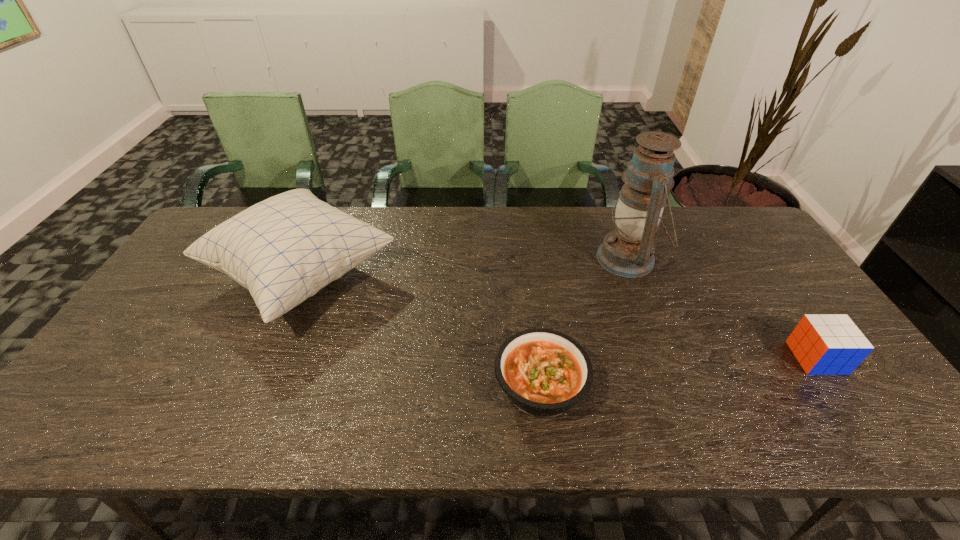
The image size is (960, 540). I want to click on vacant area situated 0.380m on the left of the third tallest object, so click(643, 357).

Find the location of a particular element. vacant space located on the left of the third object from right to left is located at coordinates (379, 385).

Identify the location of oil lamp at the far edge. This screenshot has width=960, height=540. (628, 251).

The image size is (960, 540). I want to click on cushion present at the far edge, so click(284, 249).

This screenshot has height=540, width=960. In order to click on object that is at the near edge in this screenshot , I will do `click(544, 372)`.

You are a GUI agent. You are given a task and a screenshot of the screen. Output one action in this format:
    pyautogui.click(x=<x>, y=<y>)
    Task: Click on the object that is at the left edge
    The height and width of the screenshot is (540, 960).
    Given the screenshot: What is the action you would take?
    pos(284,249)

The height and width of the screenshot is (540, 960). In order to click on object situated at the right edge in this screenshot , I will do `click(826, 344)`.

The height and width of the screenshot is (540, 960). What are the coordinates of `object located at the far left corner` in the screenshot? It's located at (284, 249).

In the image, there is a desktop. Identify the location of free region at the far edge. (421, 220).

This screenshot has height=540, width=960. What are the coordinates of `vacant space at the near edge of the desktop` in the screenshot? It's located at (776, 436).